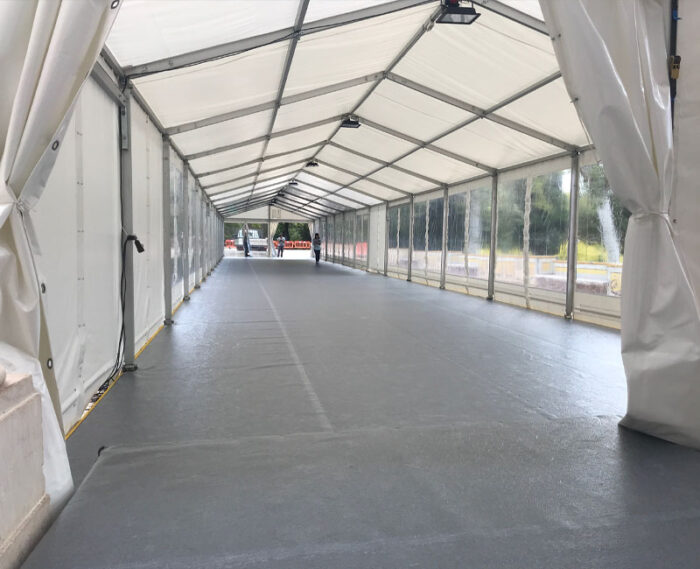
Find the location of `lights`. lights is located at coordinates (290, 182), (311, 163), (279, 193), (273, 200), (349, 123), (456, 17).